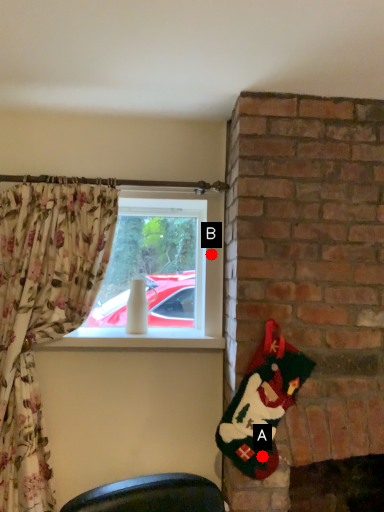
Question: Two points are circled on the image, labeled by A and B beside each circle. Among these points, which one is nearest to the camera?

Choices:
 (A) A is closer
 (B) B is closer

Answer: (A)